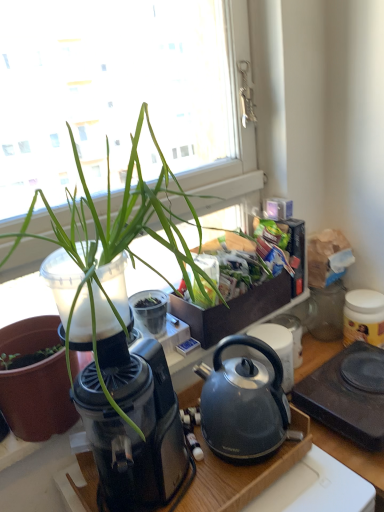
In order to click on vacant region above black plastic hot plate at lower right, arranged as the second appliance when viewed from the right (from a real-world perspective) in this screenshot , I will do `click(356, 372)`.